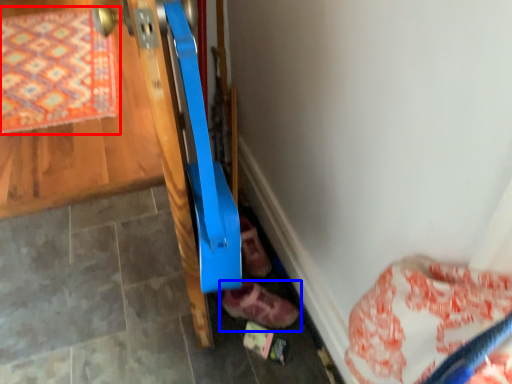
Question: Which object appears farthest to the camera in this image, mat (highlighted by a red box) or footwear (highlighted by a blue box)?

Choices:
 (A) mat
 (B) footwear

Answer: (A)